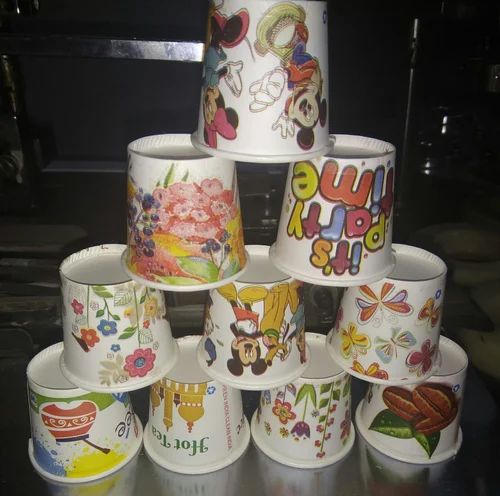
Find the location of a particular element. decorative butterflies is located at coordinates (349, 340), (393, 339), (366, 370), (381, 295), (434, 308), (422, 357), (337, 318).